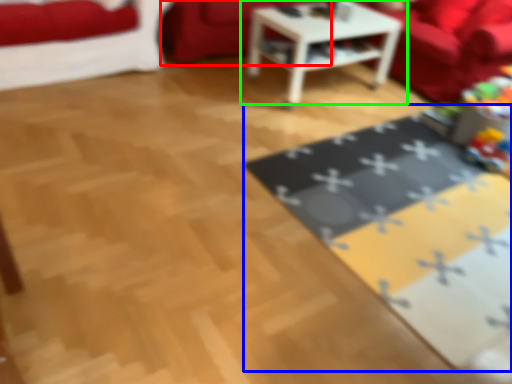
Question: Which object is the closest to the couch (highlighted by a red box)? Choose among these: mat (highlighted by a blue box) or table (highlighted by a green box).

Choices:
 (A) mat
 (B) table

Answer: (B)